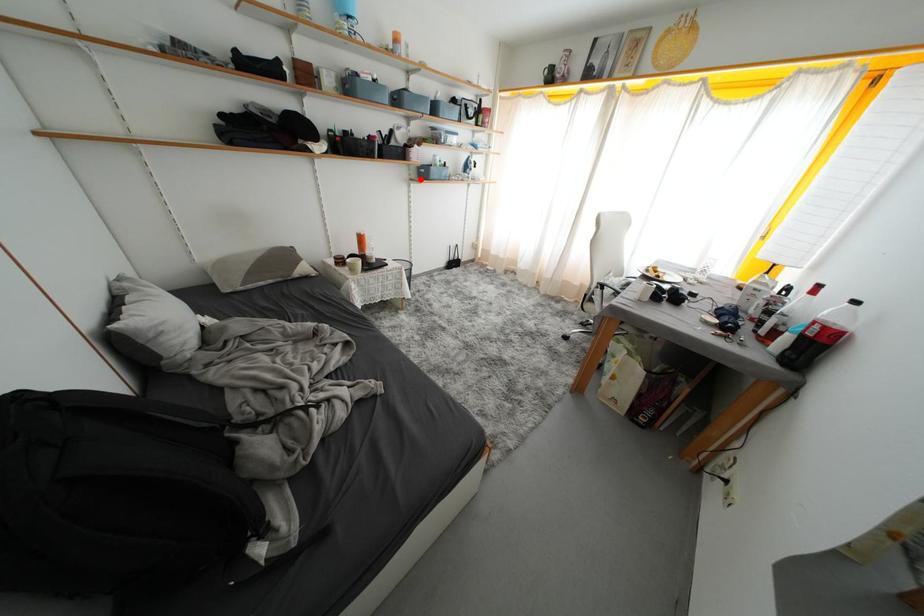
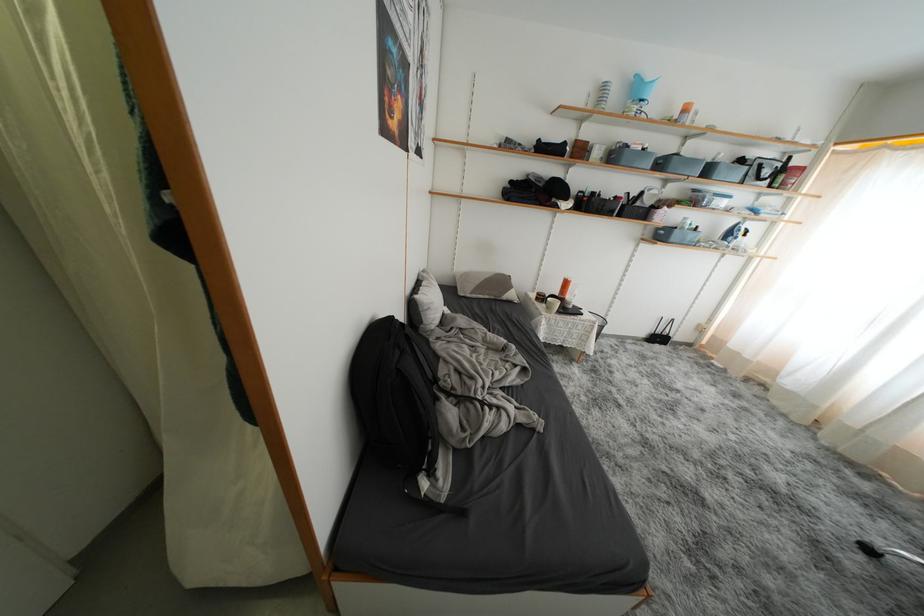
Find the pixel in the second image that matches the highlighted location in the first image.

(654, 238)